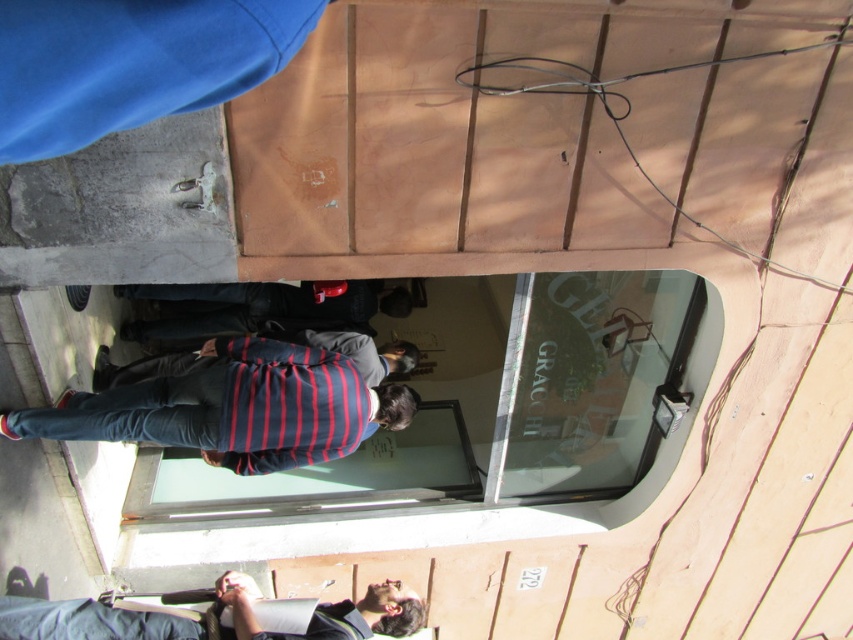
Where is the striped cotton shirt at center located in the image?

The striped cotton shirt at center is located at point (233, 408) in the image.

You are looking at the reflection in the glass door of the building. You notice two striped shirts in the reflection. Which one is lower in the image, the striped cotton shirt at center or the striped fabric shirt at center?

The striped cotton shirt at center is lower in the image because it is positioned below the striped fabric shirt at center.